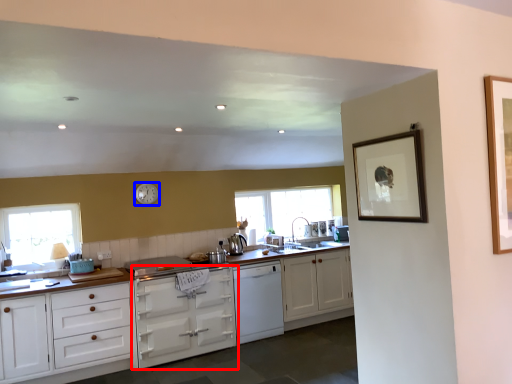
Question: Which of the following is the closest to the observer, cabinetry (highlighted by a red box) or clock (highlighted by a blue box)?

Choices:
 (A) cabinetry
 (B) clock

Answer: (A)